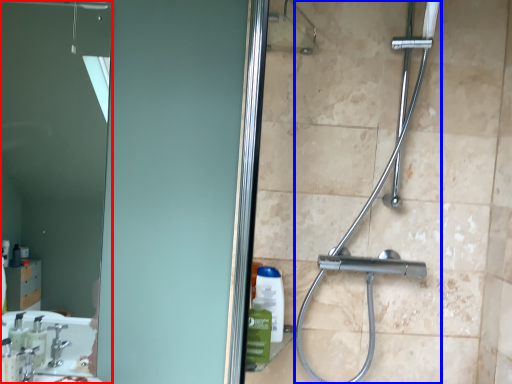
Question: Which object is further to the camera taking this photo, mirror (highlighted by a red box) or shower (highlighted by a blue box)?

Choices:
 (A) mirror
 (B) shower

Answer: (A)